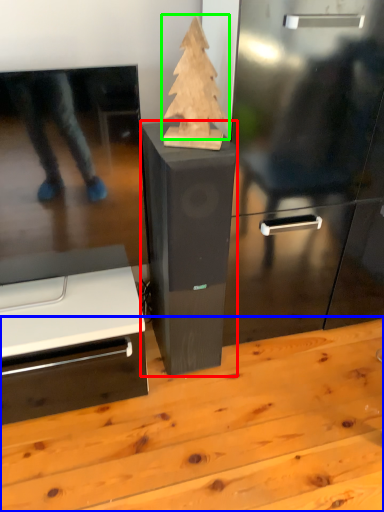
Question: Estimate the real-world distances between objects in this image. Which object is farther from furniture (highlighted by a red box), table (highlighted by a blue box) or christmas tree (highlighted by a green box)?

Choices:
 (A) table
 (B) christmas tree

Answer: (A)